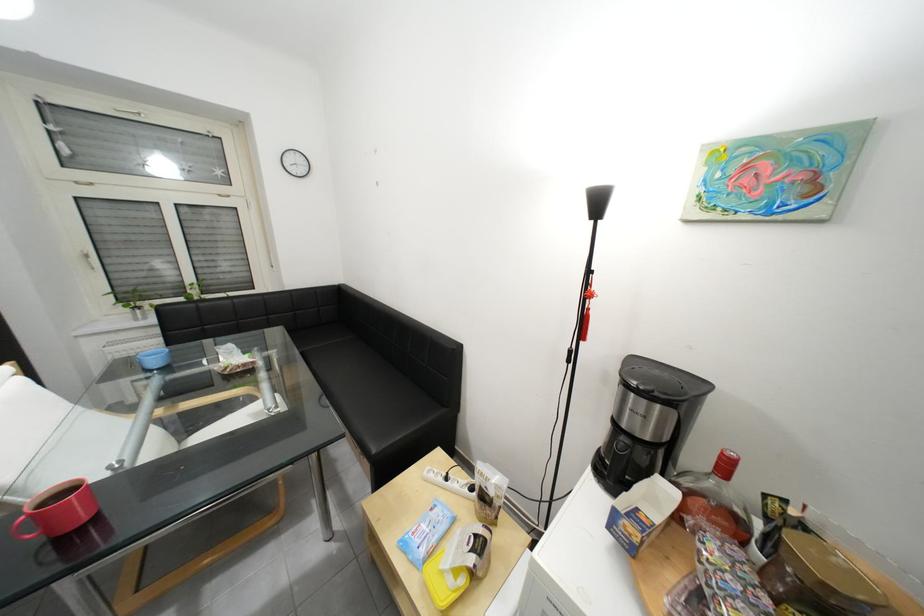
Find where to lift the coffee maker lid. Please return your answer as a coordinate pair (x, y).

(648, 422)